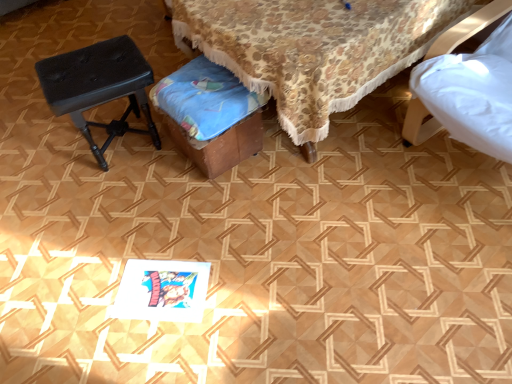
Locate an element on the screen. This screenshot has width=512, height=384. vacant area that is in front of wooden music stool at center is located at coordinates (222, 211).